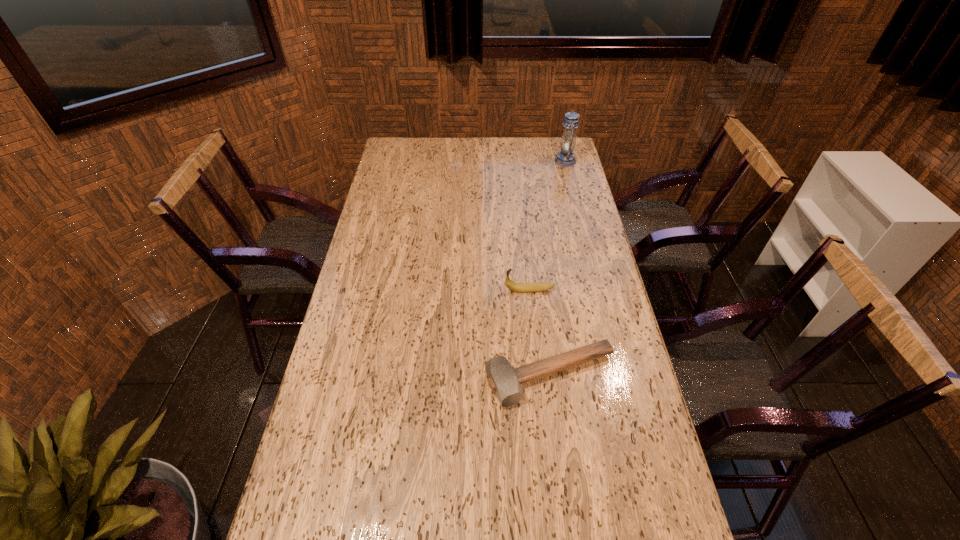
Identify the location of free space between the lantern and the mallet. The height and width of the screenshot is (540, 960). (558, 268).

Where is `free space that is in between the farthest object and the second nearest object`? This screenshot has width=960, height=540. free space that is in between the farthest object and the second nearest object is located at coordinates (547, 226).

You are a GUI agent. You are given a task and a screenshot of the screen. Output one action in this format:
    pyautogui.click(x=<x>, y=<y>)
    Task: Click on the unoccupied area between the tallest object and the nearest object
    This screenshot has width=960, height=540.
    Given the screenshot: What is the action you would take?
    pyautogui.click(x=558, y=268)

This screenshot has width=960, height=540. I want to click on unoccupied position between the tallest object and the banana, so click(x=547, y=226).

Identify which object is the closest to the nearest object. Please provide its 2D coordinates. Your answer should be formatted as a tuple, i.e. [(x, y)], where the tuple contains the x and y coordinates of a point satisfying the conditions above.

[(514, 286)]

Choose which object is the second nearest neighbor to the shortest object. Please provide its 2D coordinates. Your answer should be formatted as a tuple, i.e. [(x, y)], where the tuple contains the x and y coordinates of a point satisfying the conditions above.

[(565, 157)]

Locate an element on the screen. vacant space that satisfies the following two spatial constraints: 1. at the stem of the second tallest object; 2. on the right side of the shortest object is located at coordinates (538, 376).

Locate an element on the screen. The height and width of the screenshot is (540, 960). vacant position in the image that satisfies the following two spatial constraints: 1. at the stem of the nearest object; 2. on the left side of the second shortest object is located at coordinates (538, 376).

The width and height of the screenshot is (960, 540). Find the location of `free location that satisfies the following two spatial constraints: 1. at the stem of the banana; 2. on the left side of the nearest object`. free location that satisfies the following two spatial constraints: 1. at the stem of the banana; 2. on the left side of the nearest object is located at coordinates (538, 376).